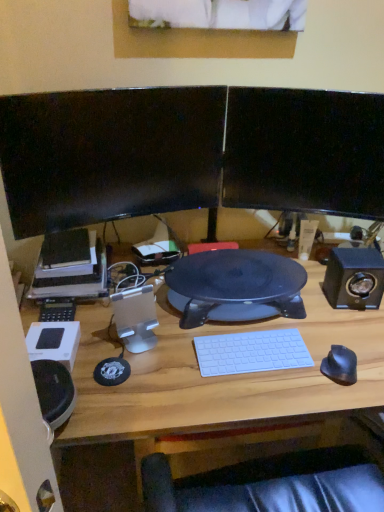
Where is `free space in front of black matte mouse at right`? The image size is (384, 512). free space in front of black matte mouse at right is located at coordinates (342, 399).